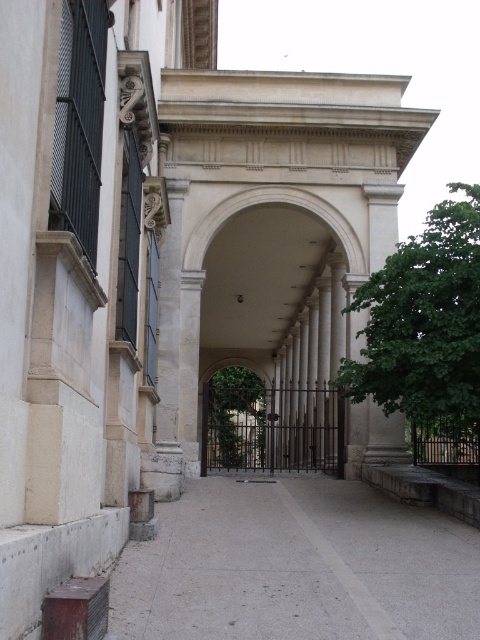
You are a delivery person trying to navigate a narrow alleyway. You see the gray concrete pavement at center and the green metal gate at center. Which path should you choose to ensure your delivery van can pass through comfortably?

The gray concrete pavement at center is wider than the green metal gate at center, so you should choose the gray concrete pavement at center to ensure your delivery van can pass through comfortably.

You are standing at the entrance of the classical structure and want to walk straight ahead. There is a gray concrete pavement at center and a green leafy tree at center in your path. Which one do you need to step over or around to continue walking forward?

The gray concrete pavement at center is wider than the green leafy tree at center, so you would need to step over or around the green leafy tree at center since it is narrower and likely occupies less space in your path.